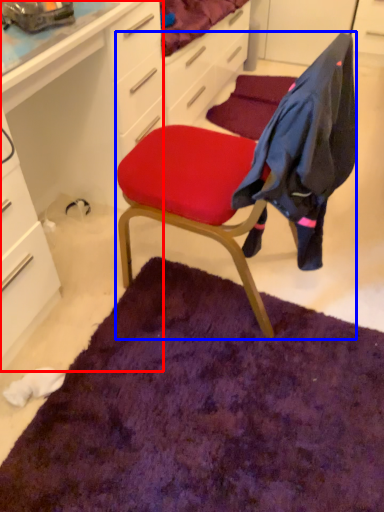
Question: Among these objects, which one is nearest to the camera, computer desk (highlighted by a red box) or chair (highlighted by a blue box)?

Choices:
 (A) computer desk
 (B) chair

Answer: (A)